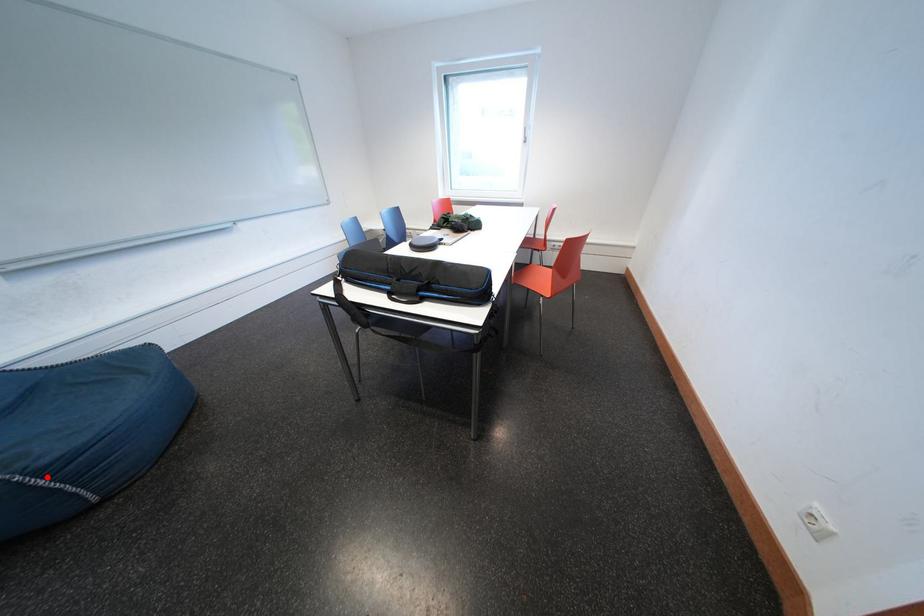
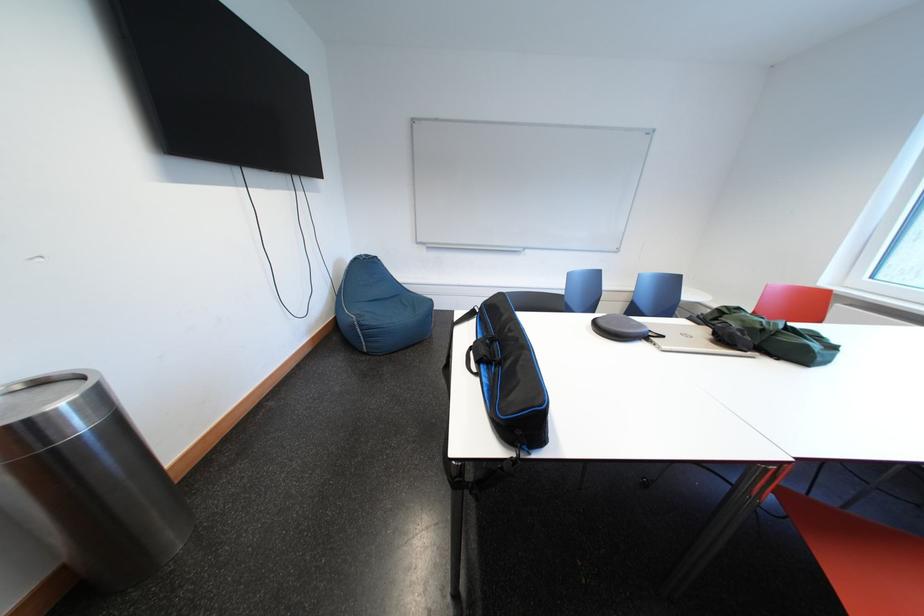
The point at the highlighted location is marked in the first image. Where is the corresponding point in the second image?

(370, 330)